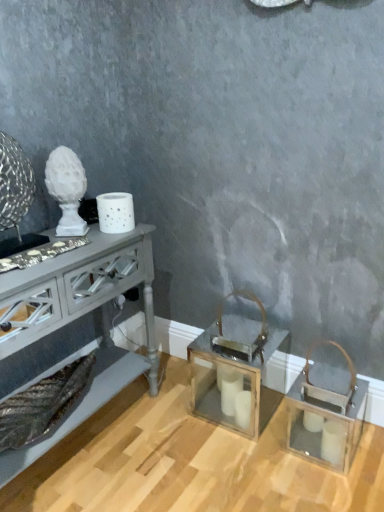
Find the location of `vacant area that lies between clear glass lantern at center, the 2th table in the left-to-right sequence, and matte gray console table at left, which is the first table in left-to-right order`. vacant area that lies between clear glass lantern at center, the 2th table in the left-to-right sequence, and matte gray console table at left, which is the first table in left-to-right order is located at coordinates (165, 442).